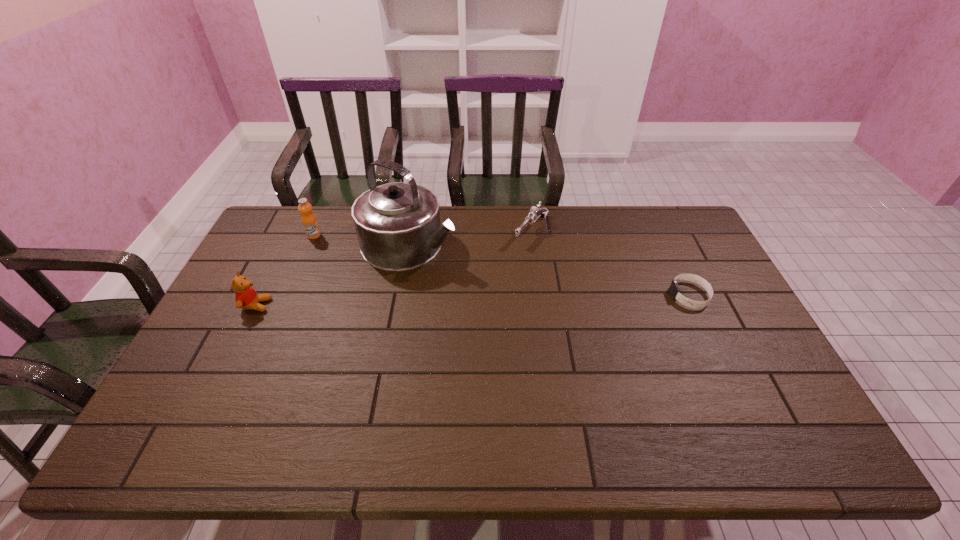
What are the coordinates of `vacant space at the far edge of the desktop` in the screenshot? It's located at (464, 216).

In the image, there is a desktop. At what (x,y) coordinates should I click in order to perform the action: click on vacant area at the near edge. Please return your answer as a coordinate pair (x, y). The width and height of the screenshot is (960, 540). Looking at the image, I should click on (655, 393).

The image size is (960, 540). What are the coordinates of `vacant area at the left edge` in the screenshot? It's located at (258, 315).

Where is `vacant space at the right edge of the desktop`? Image resolution: width=960 pixels, height=540 pixels. vacant space at the right edge of the desktop is located at coordinates (744, 349).

In order to click on blank space at the far left corner in this screenshot , I will do `click(278, 220)`.

The image size is (960, 540). In the image, there is a desktop. In order to click on vacant space at the near left corner in this screenshot , I will do `click(221, 383)`.

This screenshot has height=540, width=960. I want to click on vacant space at the near right corner, so click(780, 386).

At what (x,y) coordinates should I click in order to perform the action: click on vacant space that is in between the third shortest object and the kettle. Please return your answer as a coordinate pair (x, y). Looking at the image, I should click on (333, 274).

Image resolution: width=960 pixels, height=540 pixels. Find the location of `blank region between the second tallest object and the teddy bear`. blank region between the second tallest object and the teddy bear is located at coordinates (285, 270).

Find the location of a particular element. The width and height of the screenshot is (960, 540). empty location between the shortest object and the leftmost object is located at coordinates (473, 300).